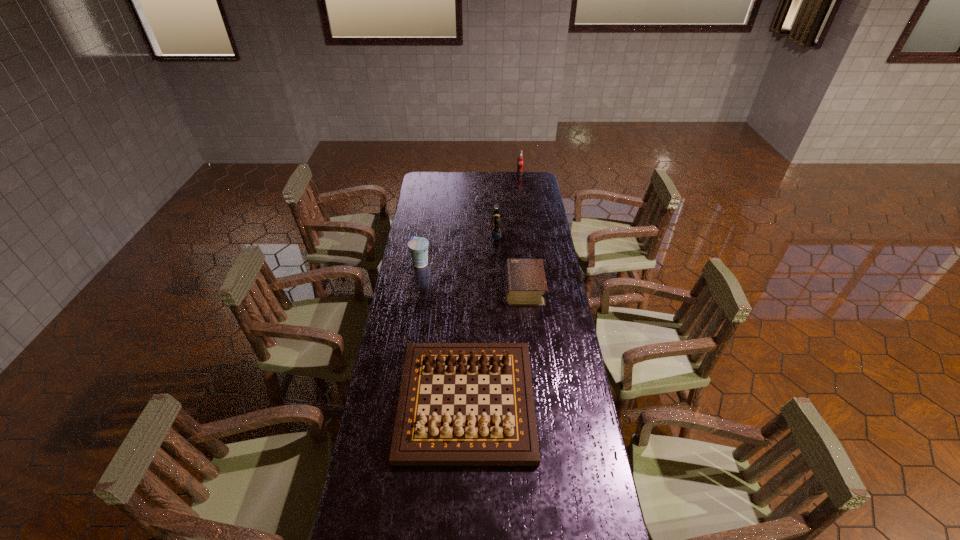
Identify the location of object that is at the far right corner. Image resolution: width=960 pixels, height=540 pixels. (520, 162).

Where is `vacant space at the far edge`? vacant space at the far edge is located at coordinates (485, 192).

At what (x,y) coordinates should I click in order to perform the action: click on vacant point at the left edge. Please return your answer as a coordinate pair (x, y). This screenshot has width=960, height=540. Looking at the image, I should click on (415, 198).

Identify the location of free location at the right edge. (529, 254).

Find the location of `free region at the far left corner`. free region at the far left corner is located at coordinates (426, 187).

You are a GUI agent. You are given a task and a screenshot of the screen. Output one action in this format:
    pyautogui.click(x=<x>, y=<y>)
    Task: Click on the free space at the far right corner of the desktop
    Image resolution: width=960 pixels, height=540 pixels.
    Given the screenshot: What is the action you would take?
    pyautogui.click(x=540, y=172)

In order to click on vacant area between the farthest object and the gameboard in this screenshot , I will do coord(493,287).

This screenshot has width=960, height=540. I want to click on empty space between the gameboard and the soda bottle, so click(x=493, y=287).

I want to click on free space between the third farthest object and the headset, so click(458, 248).

Locate an element on the screen. empty space that is in between the shortest object and the third nearest object is located at coordinates (472, 276).